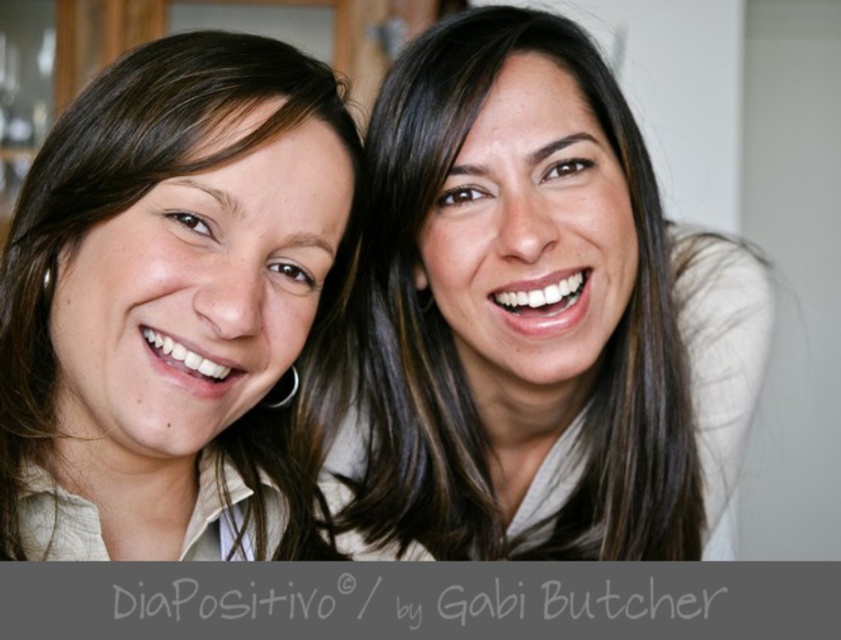
Does smooth skin face at upper right have a greater width compared to matte beige shirt at left?

Yes, smooth skin face at upper right is wider than matte beige shirt at left.

Is the position of smooth skin face at upper right less distant than that of matte beige shirt at left?

No, smooth skin face at upper right is behind matte beige shirt at left.

Is point (754, 349) closer to camera compared to point (110, 536)?

No, it is behind (110, 536).

The height and width of the screenshot is (640, 841). Identify the location of smooth skin face at upper right. (533, 310).